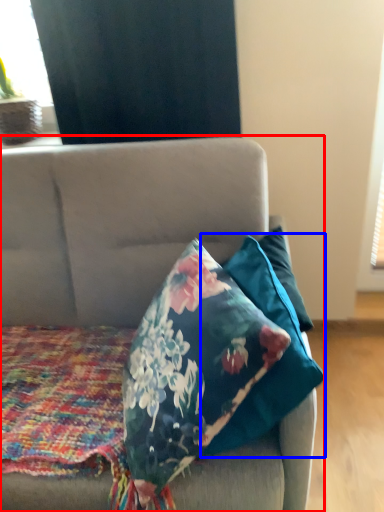
Question: Which object is further to the camera taking this photo, studio couch (highlighted by a red box) or pillow (highlighted by a blue box)?

Choices:
 (A) studio couch
 (B) pillow

Answer: (B)